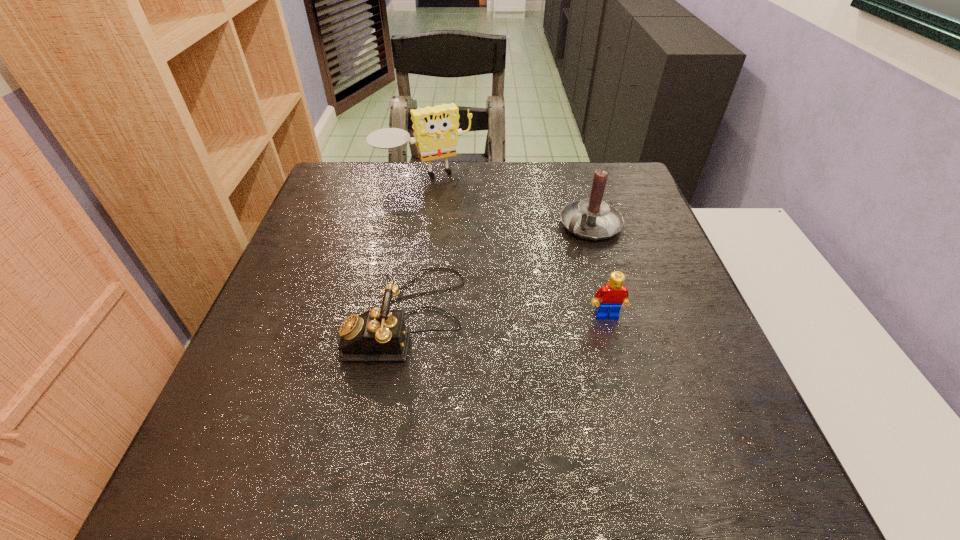
This screenshot has width=960, height=540. In order to click on vacant area that satisfies the following two spatial constraints: 1. on the front side of the candle; 2. on the left side of the farthest object in this screenshot , I will do `click(416, 225)`.

Where is `free space that satisfies the following two spatial constraints: 1. on the front side of the farthest object; 2. on the dial of the telephone`? This screenshot has height=540, width=960. free space that satisfies the following two spatial constraints: 1. on the front side of the farthest object; 2. on the dial of the telephone is located at coordinates (400, 317).